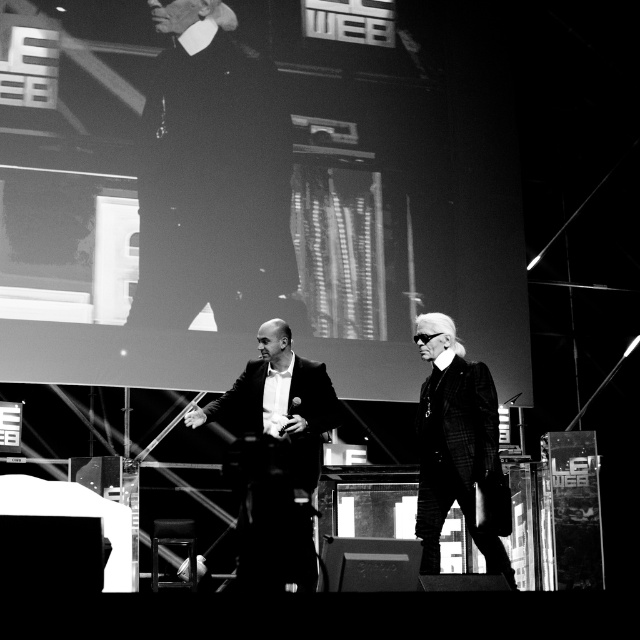
You are an event planner arranging seating for a panel discussion. You need to place two chairs for the speakers. The first chair should be to the left of the second chair. Given the positions of the dark velvet suit at upper left and plaid wool business suit at right in the image, which speaker should sit where?

The speaker wearing the dark velvet suit at upper left should sit in the first chair to the left, and the speaker in the plaid wool business suit at right should sit in the second chair to the right, since the dark velvet suit at upper left is positioned to the left of the plaid wool business suit at right in the image.

You are a photographer adjusting your camera focus. You need to focus on both the point at [273,420] and the point at [499,465]. Which point is closer to the camera lens?

Point at [273,420] is closer to the camera lens than point at [499,465] because the description states that point [273,420] is further to the camera than point [499,465]. Wait, there might be a confusion here. Let me check again. The description says, Point [273,420] is further to the camera than point [499,465]. That means point [273,420] is farther away from the camera, so the closer one is point [499,465]. Hmm, the user might have made a mistake in the answer. Let me rephrase. The

You are a photographer at the event and need to adjust the camera focus. The smooth black suit at center and the plaid wool business suit at right are both in the frame. Given that the camera can focus on objects within a 30 inch range, will both suits be in focus?

The smooth black suit at center is 30.79 inches away from the plaid wool business suit at right. Since the distance between them exceeds the camera focus range of 30 inches, the camera cannot focus on both suits simultaneously.